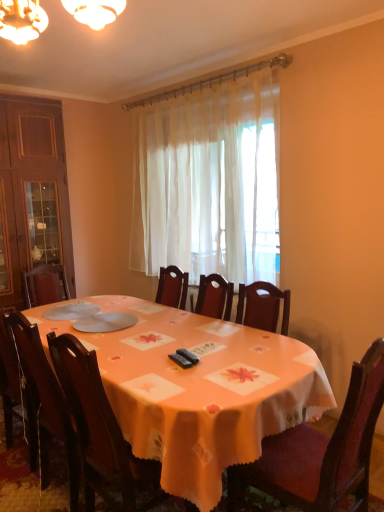
Question: Looking at the image, does sheer white curtain at center seem bigger or smaller compared to wooden chair at lower right, the 3th chair in the left-to-right sequence?

Choices:
 (A) big
 (B) small

Answer: (A)

Question: From the image's perspective, is sheer white curtain at center positioned above or below wooden chair at lower right, which is counted as the first chair, starting from the right?

Choices:
 (A) below
 (B) above

Answer: (B)

Question: Which is farther from the sheer white curtain at center?

Choices:
 (A) dark wood chair at lower left, the third chair in the right-to-left sequence
 (B) white matte plates at center
 (C) wooden chair at center, acting as the 2th chair starting from the left
 (D) wooden chair at lower right, which is counted as the first chair, starting from the right
 (E) orange fabric table at center

Answer: (D)

Question: Which object is positioned farthest from the orange fabric table at center?

Choices:
 (A) sheer white curtain at center
 (B) white matte plates at center
 (C) wooden chair at center, the second chair when ordered from right to left
 (D) dark wood chair at lower left, which ranks as the 1th chair in left-to-right order
 (E) wooden chair at lower right, which is counted as the first chair, starting from the right

Answer: (A)